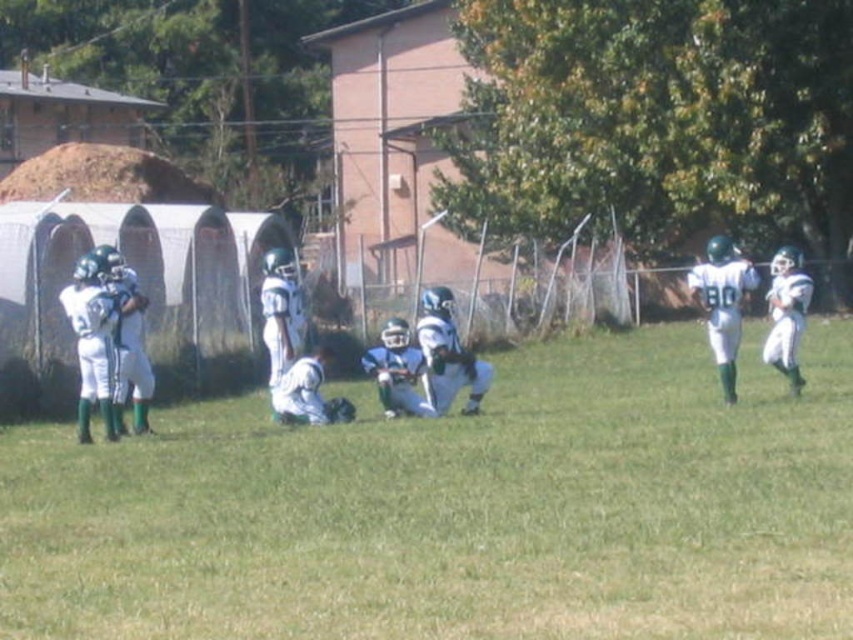
Question: Which of the following is the farthest from the observer?

Choices:
 (A) white matte football player at right
 (B) white uniformed players at center
 (C) white matte uniform at right

Answer: (C)

Question: Which of the following is the farthest from the observer?

Choices:
 (A) white matte football players at left
 (B) white uniformed players at center
 (C) white matte football player at right

Answer: (C)

Question: Which point is closer to the camera?

Choices:
 (A) (785, 518)
 (B) (114, 417)
 (C) (773, 296)
 (D) (692, 269)

Answer: (A)

Question: Is white matte football player at right positioned at the back of white matte uniform at right?

Choices:
 (A) no
 (B) yes

Answer: (A)

Question: Is white uniformed players at center bigger than white matte football player at right?

Choices:
 (A) yes
 (B) no

Answer: (B)

Question: Does white matte football players at left have a lesser width compared to white matte uniform at right?

Choices:
 (A) no
 (B) yes

Answer: (A)